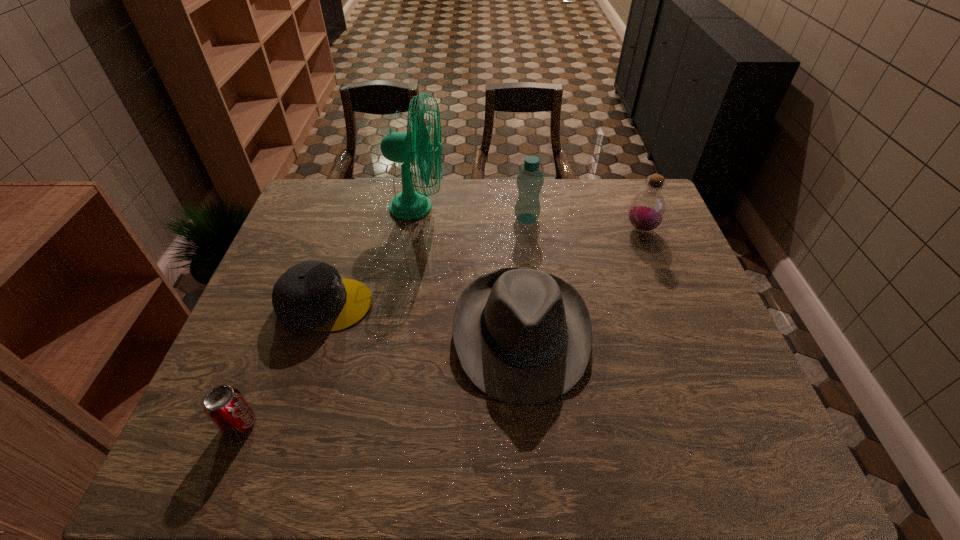
This screenshot has height=540, width=960. Identify the location of vacant space that is in between the tallest object and the left bottle. (472, 213).

Locate an element on the screen. free space between the fourth tallest object and the fan is located at coordinates (469, 270).

I want to click on free space between the fourth tallest object and the cap, so click(x=423, y=319).

The width and height of the screenshot is (960, 540). I want to click on object that stands as the second closest to the third shortest object, so click(530, 179).

Identify which object is the closest to the nearest object. Please provide its 2D coordinates. Your answer should be formatted as a tuple, i.e. [(x, y)], where the tuple contains the x and y coordinates of a point satisfying the conditions above.

[(310, 296)]

At what (x,y) coordinates should I click in order to perform the action: click on vacant space that satisfies the following two spatial constraints: 1. in front of the rightmost object to blow air; 2. on the right side of the tallest object. Please return your answer as a coordinate pair (x, y). This screenshot has height=540, width=960. Looking at the image, I should click on (414, 229).

In order to click on vacant area in the image that satisfies the following two spatial constraints: 1. in front of the left bottle to blow air; 2. on the left side of the fan in this screenshot , I will do [416, 219].

Where is `vacant area that satisfies the following two spatial constraints: 1. on the front side of the right bottle; 2. on the left side of the left bottle`? Image resolution: width=960 pixels, height=540 pixels. vacant area that satisfies the following two spatial constraints: 1. on the front side of the right bottle; 2. on the left side of the left bottle is located at coordinates (528, 229).

You are a GUI agent. You are given a task and a screenshot of the screen. Output one action in this format:
    pyautogui.click(x=<x>, y=<y>)
    Task: Click on the free spot that satisfies the following two spatial constraints: 1. in front of the fan to blow air; 2. on the back side of the left bottle
    This screenshot has width=960, height=540.
    Given the screenshot: What is the action you would take?
    pyautogui.click(x=416, y=219)

Where is `vacant area that satisfies the following two spatial constraints: 1. in front of the tallest object to blow air; 2. on the back side of the rightmost object`? The image size is (960, 540). vacant area that satisfies the following two spatial constraints: 1. in front of the tallest object to blow air; 2. on the back side of the rightmost object is located at coordinates (414, 229).